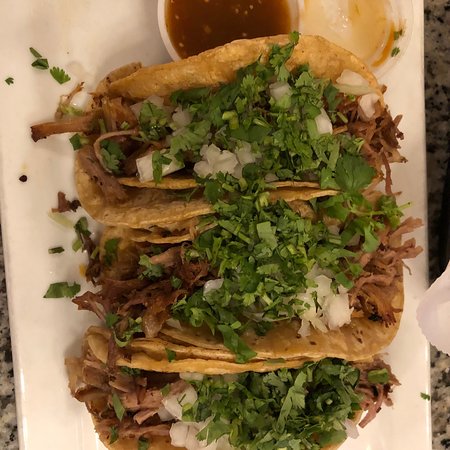
The image size is (450, 450). I want to click on counter top, so click(439, 35), click(439, 406), click(7, 396).